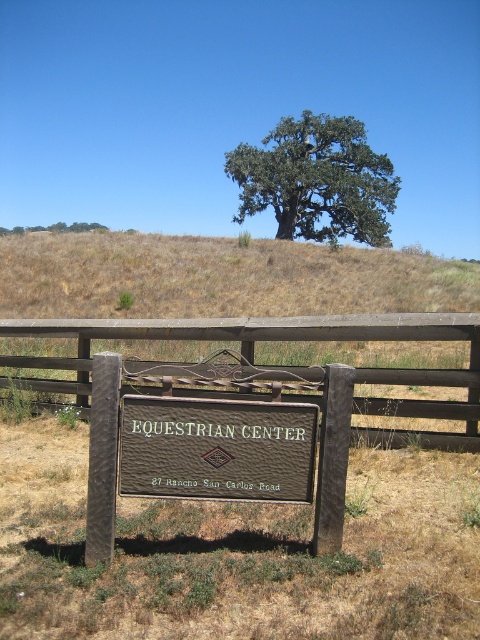
Which is below, brown wooden fence at center or brown leather sign at center?

Positioned lower is brown leather sign at center.

In the scene shown: Does brown wooden fence at center appear under brown leather sign at center?

No, brown wooden fence at center is not below brown leather sign at center.

What do you see at coordinates (275, 364) in the screenshot?
I see `brown wooden fence at center` at bounding box center [275, 364].

The image size is (480, 640). Identify the location of brown wooden fence at center. (275, 364).

How distant is brown leather sign at center from green leafy tree at upper center?

brown leather sign at center is 37.55 meters from green leafy tree at upper center.

Is point (264, 481) less distant than point (332, 116)?

That is True.

Find the location of a particular element. brown leather sign at center is located at coordinates (216, 449).

Can you confirm if brown wooden fence at center is smaller than green leafy tree at upper center?

Indeed, brown wooden fence at center has a smaller size compared to green leafy tree at upper center.

Looking at this image, who is more forward, [52,380] or [296,148]?

Point [52,380] is in front.

Find the location of a particular element. brown wooden fence at center is located at coordinates (275, 364).